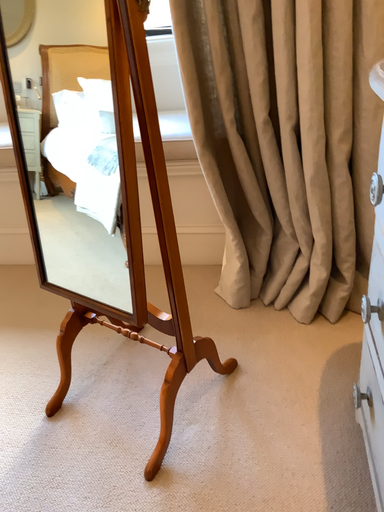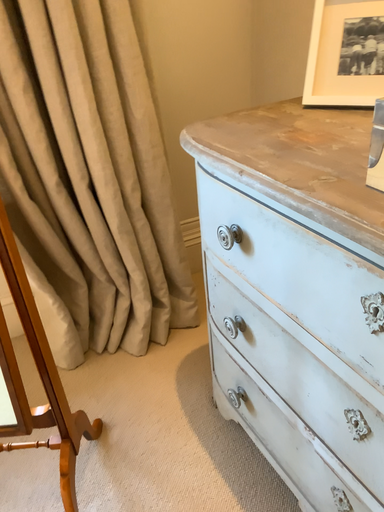
Question: Which way did the camera rotate in the video?

Choices:
 (A) rotated upward
 (B) rotated downward

Answer: (A)